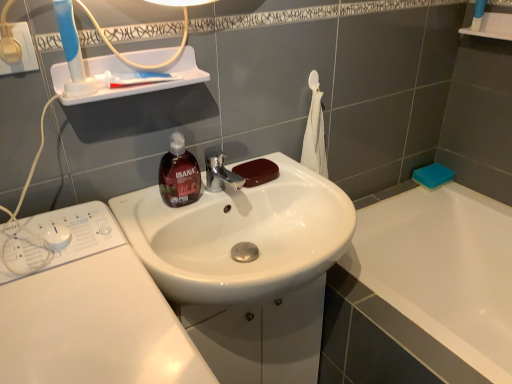
Question: Considering the relative sizes of blue plastic toothbrush at upper left and white glossy washing machine at lower left in the image provided, is blue plastic toothbrush at upper left thinner than white glossy washing machine at lower left?

Choices:
 (A) no
 (B) yes

Answer: (B)

Question: Could white glossy washing machine at lower left be considered to be inside blue plastic toothbrush at upper left?

Choices:
 (A) no
 (B) yes

Answer: (A)

Question: From the image's perspective, is blue plastic toothbrush at upper left located above white glossy washing machine at lower left?

Choices:
 (A) yes
 (B) no

Answer: (A)

Question: Is blue plastic toothbrush at upper left positioned with its back to white glossy washing machine at lower left?

Choices:
 (A) yes
 (B) no

Answer: (B)

Question: Considering the relative sizes of blue plastic toothbrush at upper left and white glossy washing machine at lower left in the image provided, is blue plastic toothbrush at upper left shorter than white glossy washing machine at lower left?

Choices:
 (A) yes
 (B) no

Answer: (A)

Question: Is brown matte soap at sink, which is the first soap in front-to-back order, taller or shorter than translucent brown soap dispenser at center?

Choices:
 (A) short
 (B) tall

Answer: (A)

Question: Is point (260, 172) closer or farther from the camera than point (161, 157)?

Choices:
 (A) farther
 (B) closer

Answer: (A)

Question: Is brown matte soap at sink, which is the 1th soap from left to right, bigger or smaller than translucent brown soap dispenser at center?

Choices:
 (A) big
 (B) small

Answer: (B)

Question: From the image's perspective, is brown matte soap at sink, which is the 1th soap from left to right, located above or below translucent brown soap dispenser at center?

Choices:
 (A) below
 (B) above

Answer: (A)

Question: Based on their positions, is blue sponge at right, the second soap positioned from the front, located to the left or right of white glossy sink at center?

Choices:
 (A) right
 (B) left

Answer: (A)

Question: In terms of width, does blue sponge at right, arranged as the second soap when viewed from the left, look wider or thinner when compared to white glossy sink at center?

Choices:
 (A) thin
 (B) wide

Answer: (A)

Question: From the image's perspective, is blue sponge at right, arranged as the second soap when viewed from the left, above or below white glossy sink at center?

Choices:
 (A) above
 (B) below

Answer: (A)

Question: Looking at the image, does blue sponge at right, which ranks as the first soap in back-to-front order, seem bigger or smaller compared to white glossy sink at center?

Choices:
 (A) small
 (B) big

Answer: (A)

Question: Visually, is translucent brown soap dispenser at center positioned to the left or to the right of white glossy sink at center?

Choices:
 (A) left
 (B) right

Answer: (A)

Question: From their relative heights in the image, would you say translucent brown soap dispenser at center is taller or shorter than white glossy sink at center?

Choices:
 (A) tall
 (B) short

Answer: (B)